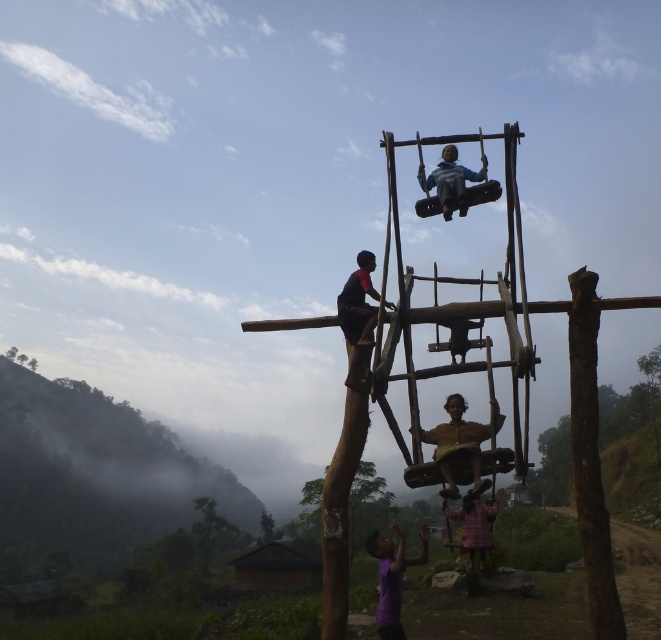
You are a parent looking at the swing structure and want to ensure safety. Which object, the brown wooden swing at center or the blue striped shirt at upper center, is closer to you as you stand at the base of the structure?

The brown wooden swing at center is closer to you because it is in front of the blue striped shirt at upper center.

You are planning to build a new swing set in your backyard and want to ensure there is enough space for both the brown wooden swing at center and the plaid fabric child at lower center. Based on the image, which object takes up more space?

The plaid fabric child at lower center occupies more space than the brown wooden swing at center according to the description.

You are a parent standing near the brown wooden swing at center and the plaid fabric child at lower center. You want to hand a snack to the child without moving from your current position. Can you reach them if your arm can extend 1.5 meters?

The brown wooden swing at center and plaid fabric child at lower center are 4.56 meters apart from each other. Since your arm can only extend 1.5 meters, you cannot reach the plaid fabric child at lower center from your current position.